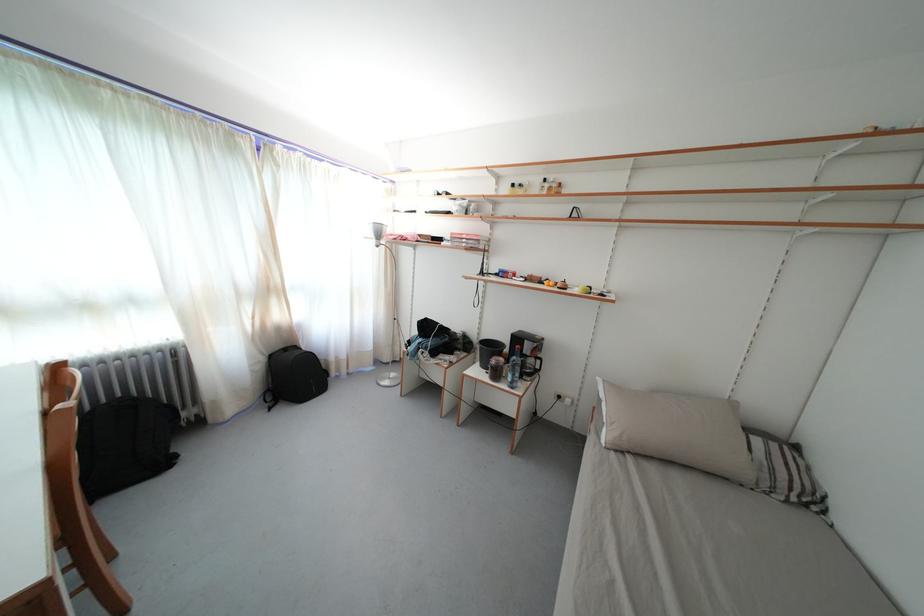
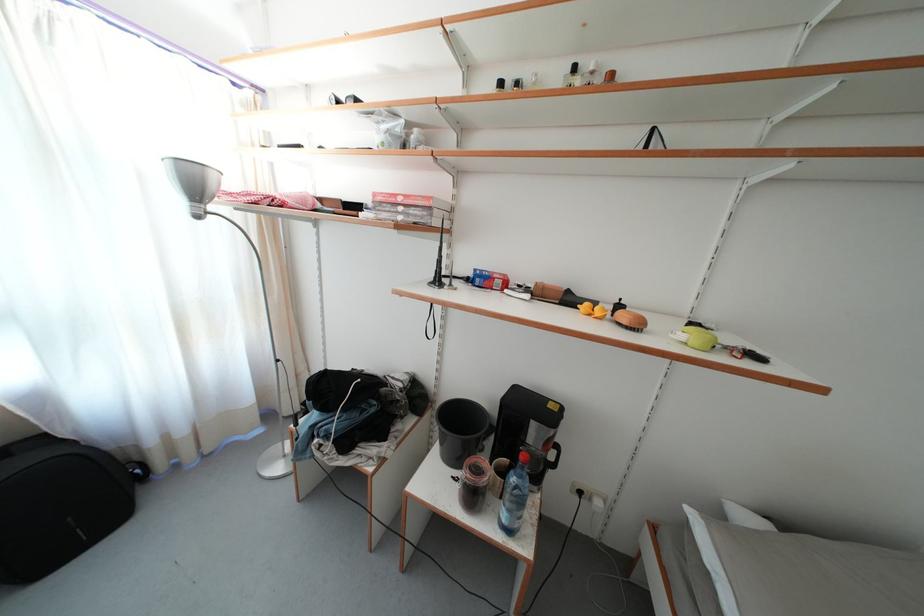
Question: In a continuous first-person perspective shot, in which direction is the camera moving?

Choices:
 (A) Left
 (B) Right
 (C) Forward
 (D) Backward

Answer: (C)